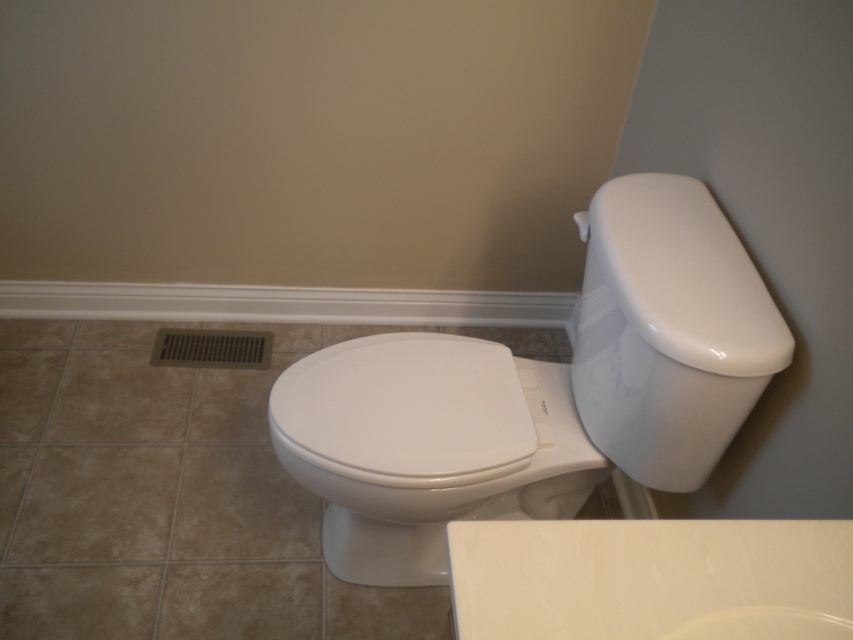
Question: Which of the following is the farthest from the observer?

Choices:
 (A) (426, 394)
 (B) (625, 276)
 (C) (677, 344)

Answer: (A)

Question: Does white glossy toilet at center have a smaller size compared to white glossy toilet bowl at center?

Choices:
 (A) yes
 (B) no

Answer: (B)

Question: Is white glossy toilet at center above white glossy toilet lid at upper right?

Choices:
 (A) yes
 (B) no

Answer: (B)

Question: Which point is farther to the camera?

Choices:
 (A) white glossy toilet bowl at center
 (B) white glossy toilet lid at upper right
 (C) white glossy toilet at center

Answer: (A)

Question: Considering the real-world distances, which object is closest to the white glossy toilet bowl at center?

Choices:
 (A) white glossy toilet lid at upper right
 (B) white glossy toilet at center

Answer: (B)

Question: Can you confirm if white glossy toilet at center is positioned above white glossy toilet bowl at center?

Choices:
 (A) yes
 (B) no

Answer: (A)